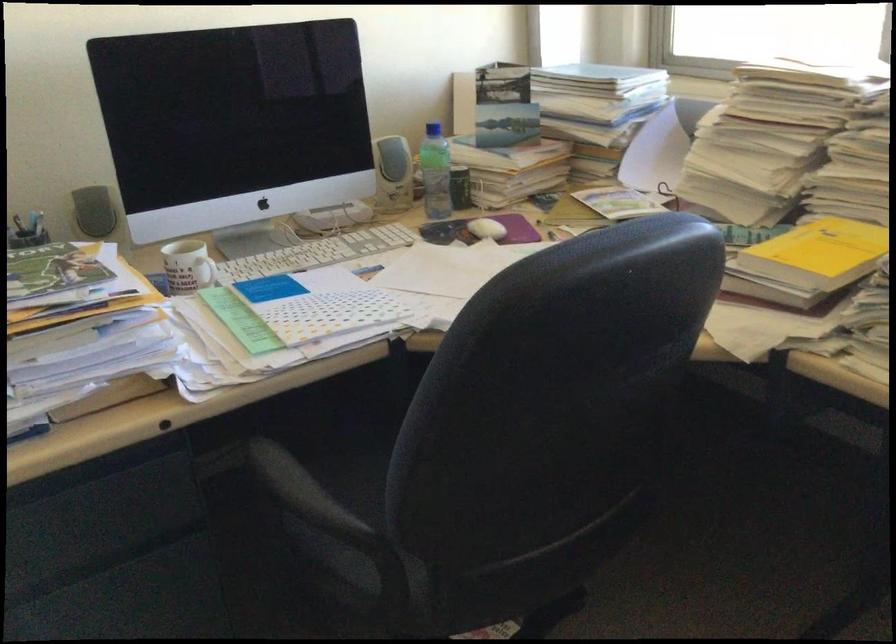
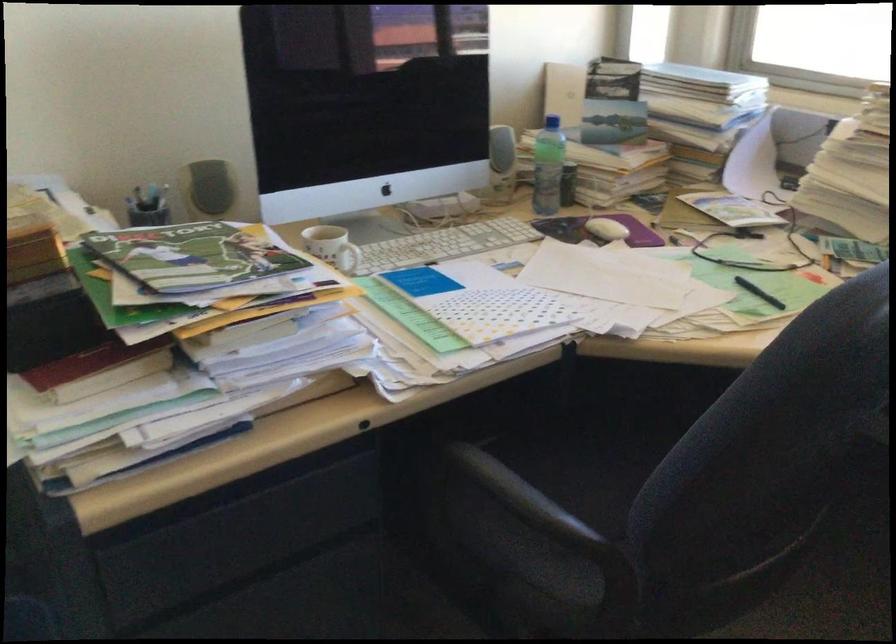
In the second image, find the point that corresponds to [202,270] in the first image.

(348, 258)